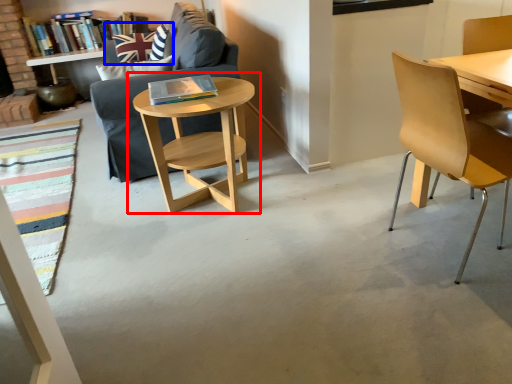
Question: Which point is further to the camera, table (highlighted by a red box) or pillow (highlighted by a blue box)?

Choices:
 (A) table
 (B) pillow

Answer: (B)